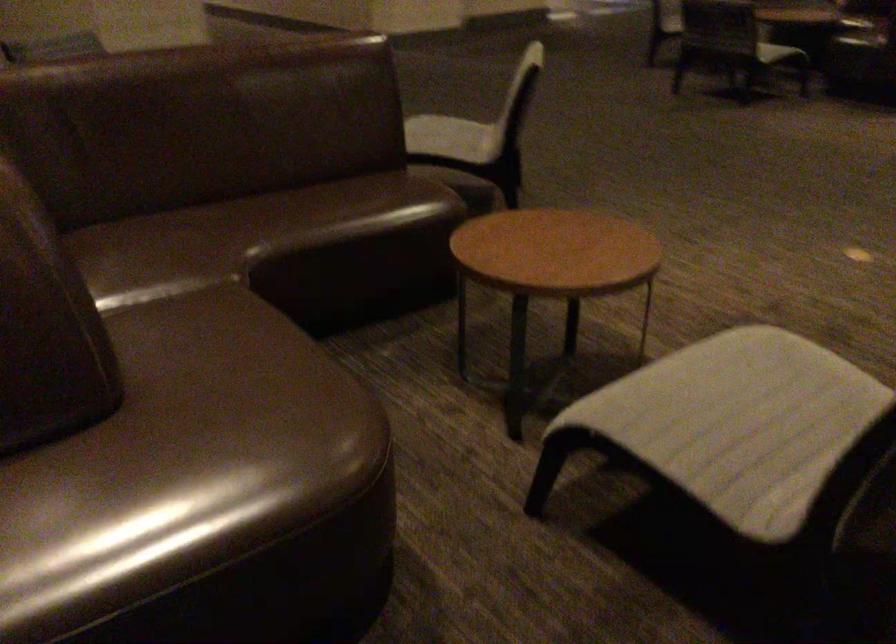
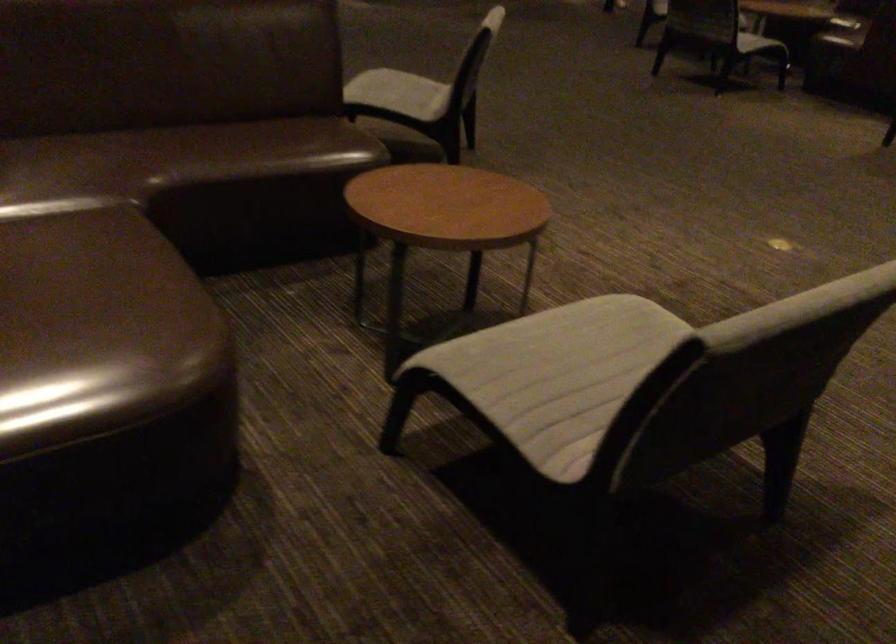
Question: The images are taken continuously from a first-person perspective. In which direction are you moving?

Choices:
 (A) Left
 (B) Right
 (C) Forward
 (D) Backward

Answer: (B)